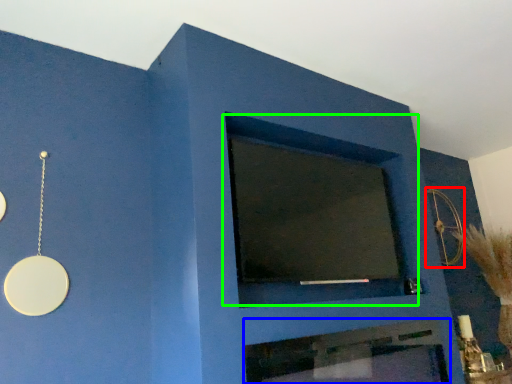
Question: Which object is positioned closest to circle (highlighted by a red box)? Select from fireplace (highlighted by a blue box) and window (highlighted by a green box).

Choices:
 (A) fireplace
 (B) window

Answer: (B)